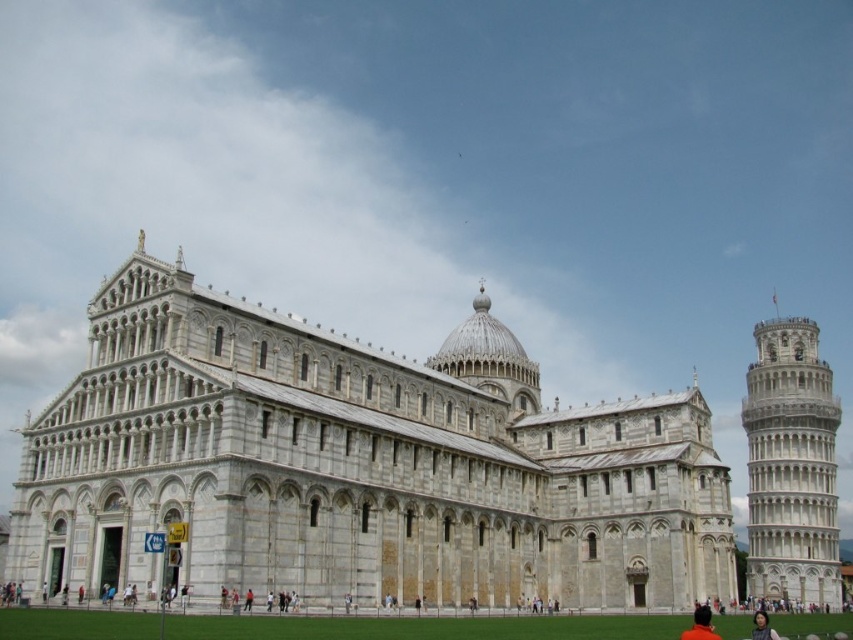
Does white stone cathedral at center have a larger size compared to smooth skin face at lower right?

Yes, white stone cathedral at center is bigger than smooth skin face at lower right.

From the picture: Which of these two, white stone cathedral at center or smooth skin face at lower right, stands taller?

white stone cathedral at center is taller.

What do you see at coordinates (357, 467) in the screenshot? The height and width of the screenshot is (640, 853). I see `white stone cathedral at center` at bounding box center [357, 467].

Image resolution: width=853 pixels, height=640 pixels. I want to click on white stone cathedral at center, so click(357, 467).

Is white stone cathedral at center positioned before white marble tower at right?

Yes, white stone cathedral at center is in front of white marble tower at right.

What are the coordinates of `white stone cathedral at center` in the screenshot? It's located at (357, 467).

Where is `white stone cathedral at center`? white stone cathedral at center is located at coordinates (357, 467).

Who is more distant from viewer, (775, 589) or (763, 616)?

Positioned behind is point (775, 589).

In the scene shown: Who is positioned more to the right, white marble tower at right or smooth skin face at lower right?

white marble tower at right is more to the right.

Identify the location of white marble tower at right. The image size is (853, 640). (791, 467).

Find the location of `white marble tower at right`. white marble tower at right is located at coordinates (791, 467).